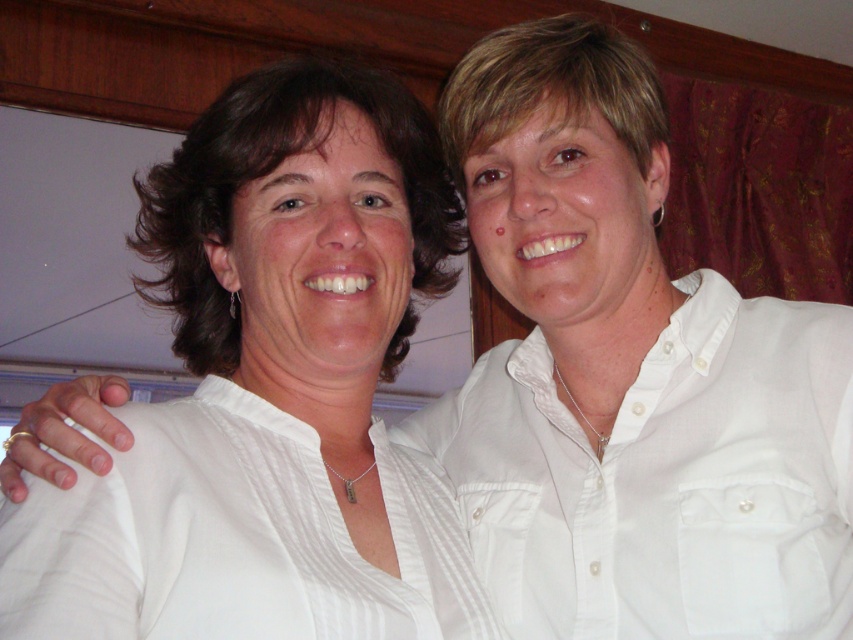
Can you confirm if white smooth shirt at center is positioned below white striped shirt at left?

No, white smooth shirt at center is not below white striped shirt at left.

Who is lower down, white smooth shirt at center or white striped shirt at left?

white striped shirt at left

You are a GUI agent. You are given a task and a screenshot of the screen. Output one action in this format:
    pyautogui.click(x=<x>, y=<y>)
    Task: Click on the white smooth shirt at center
    The width and height of the screenshot is (853, 640).
    Given the screenshot: What is the action you would take?
    [271, 390]

Between point (682, 570) and point (119, 604), which one is positioned behind?

Positioned behind is point (682, 570).

At what (x,y) coordinates should I click in order to perform the action: click on white cotton shirt at right. Please return your answer as a coordinate pair (x, y). This screenshot has height=640, width=853. Looking at the image, I should click on (664, 477).

Find the location of a particular element. The height and width of the screenshot is (640, 853). white cotton shirt at right is located at coordinates (664, 477).

Identify the location of white cotton shirt at right. (664, 477).

Can you confirm if white smooth shirt at center is positioned below white cotton shirt at right?

No, white smooth shirt at center is not below white cotton shirt at right.

Between white smooth shirt at center and white cotton shirt at right, which one is positioned higher?

white smooth shirt at center is higher up.

Is point (341, 480) positioned behind point (636, 522)?

Yes, point (341, 480) is behind point (636, 522).

The width and height of the screenshot is (853, 640). What are the coordinates of `white smooth shirt at center` in the screenshot? It's located at (271, 390).